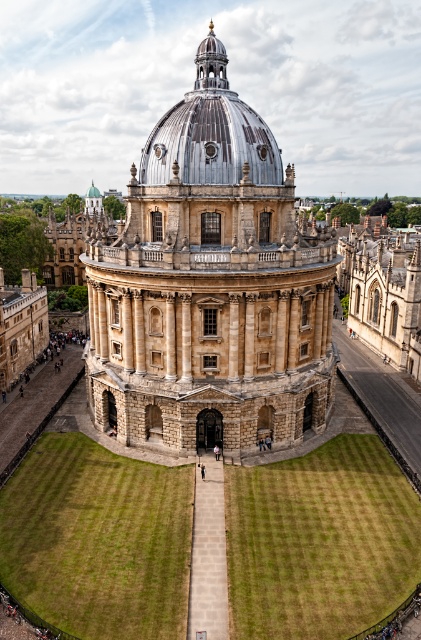
Between golden stone dome at center and shiny silver dome at center, which one is positioned lower?

golden stone dome at center is below.

Can you confirm if golden stone dome at center is bigger than shiny silver dome at center?

Incorrect, golden stone dome at center is not larger than shiny silver dome at center.

The image size is (421, 640). I want to click on golden stone dome at center, so click(x=210, y=285).

Locate an element on the screen. This screenshot has height=640, width=421. golden stone dome at center is located at coordinates (210, 285).